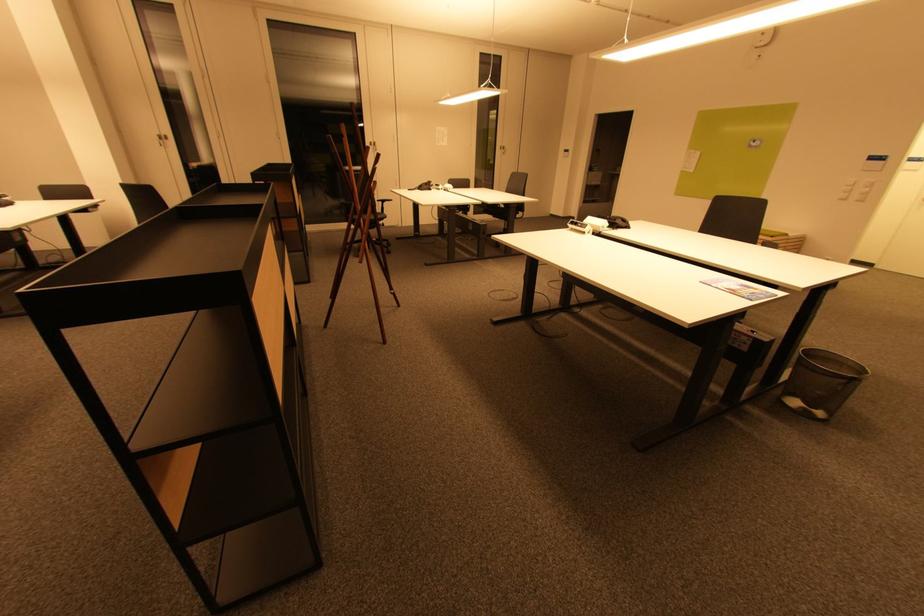
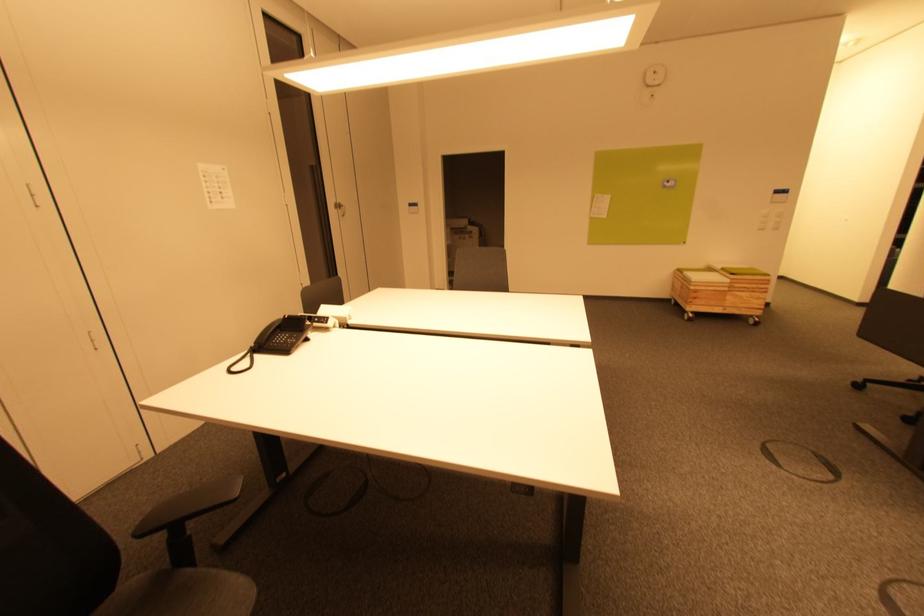
Question: I am providing you with two images of the same scene from different viewpoints. Please identify which objects are invisible in image2.

Choices:
 (A) chair sitting surface
 (B) wooden oar
 (C) green seat cushion
 (D) black telephone handset

Answer: (A)